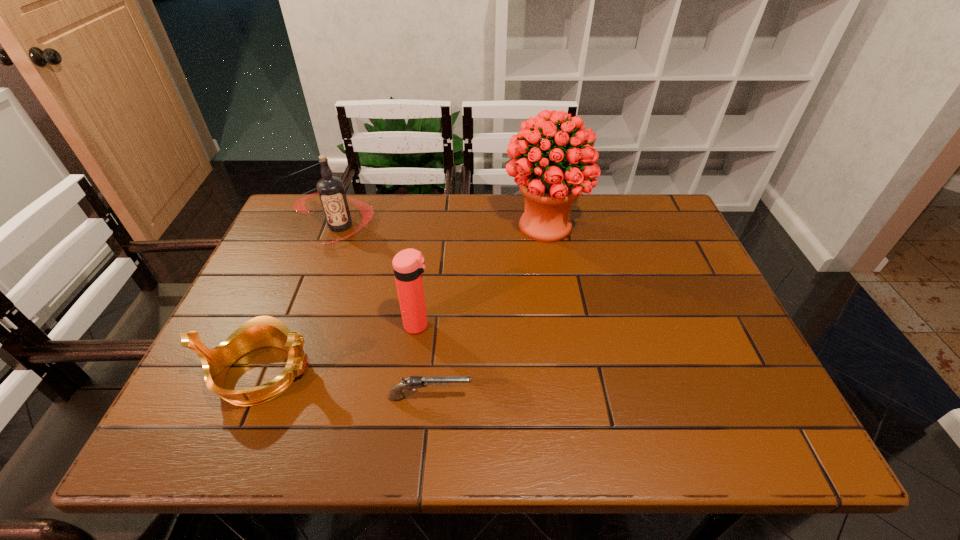
This screenshot has width=960, height=540. In order to click on vacant region between the second shortest object and the thermos bottle in this screenshot , I will do `click(340, 349)`.

You are a GUI agent. You are given a task and a screenshot of the screen. Output one action in this format:
    pyautogui.click(x=<x>, y=<y>)
    Task: Click on the vacant area that lies between the thermos bottle and the second shortest object
    
    Given the screenshot: What is the action you would take?
    pyautogui.click(x=340, y=349)

Where is `blank region between the gun and the tiara`? The image size is (960, 540). blank region between the gun and the tiara is located at coordinates (347, 385).

This screenshot has width=960, height=540. I want to click on empty space between the shortest object and the root beer, so click(385, 312).

Image resolution: width=960 pixels, height=540 pixels. What are the coordinates of `free space that is in between the third nearest object and the root beer` in the screenshot? It's located at (379, 275).

Choose which object is the second nearest neighbor to the gun. Please provide its 2D coordinates. Your answer should be formatted as a tuple, i.e. [(x, y)], where the tuple contains the x and y coordinates of a point satisfying the conditions above.

[(263, 331)]

You are a GUI agent. You are given a task and a screenshot of the screen. Output one action in this format:
    pyautogui.click(x=<x>, y=<y>)
    Task: Click on the object that is the fourth closest to the third farthest object
    Image resolution: width=960 pixels, height=540 pixels.
    Given the screenshot: What is the action you would take?
    click(549, 188)

Find the location of a particular element. The height and width of the screenshot is (540, 960). vacant space that satisfies the following two spatial constraints: 1. on the front side of the third farthest object; 2. at the front emblem of the tiara is located at coordinates (412, 373).

This screenshot has height=540, width=960. Find the location of `free location that satisfies the following two spatial constraints: 1. on the back side of the tallest object; 2. on the right side of the thermos bottle`. free location that satisfies the following two spatial constraints: 1. on the back side of the tallest object; 2. on the right side of the thermos bottle is located at coordinates (431, 225).

Locate an element on the screen. The height and width of the screenshot is (540, 960). free point that satisfies the following two spatial constraints: 1. on the label of the root beer; 2. at the front emblem of the fourth tallest object is located at coordinates (286, 373).